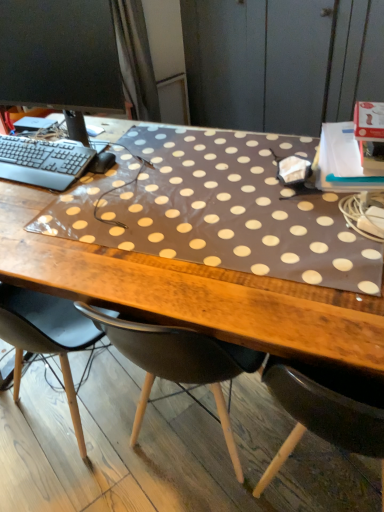
The image size is (384, 512). What are the coordinates of `black plastic keyboard at left` in the screenshot? It's located at (43, 162).

What is the approximate width of black glossy monitor at upper left?

black glossy monitor at upper left is 13.52 centimeters in width.

The image size is (384, 512). Identify the location of brown fabric dresser at upper right. (281, 61).

From the image's perspective, would you say black plastic keyboard at left is positioned over black glossy monitor at upper left?

No.

Is black plastic keyboard at left far from black glossy monitor at upper left?

No, black plastic keyboard at left is not far from black glossy monitor at upper left.

Who is shorter, black plastic keyboard at left or black glossy monitor at upper left?

With less height is black plastic keyboard at left.

Between black plastic keyboard at left and black glossy monitor at upper left, which one has smaller width?

black glossy monitor at upper left.

Is black glossy monitor at upper left facing towards black matte mouse at center?

Yes.

Is black glossy monitor at upper left surrounding black matte mouse at center?

Yes, black glossy monitor at upper left is surrounding black matte mouse at center.

Is black glossy monitor at upper left bigger than black matte mouse at center?

Yes, black glossy monitor at upper left is bigger than black matte mouse at center.

What's the angular difference between black glossy monitor at upper left and black matte mouse at center's facing directions?

black glossy monitor at upper left and black matte mouse at center are facing 0.798 degrees away from each other.

Is brown polka dot mat at center looking in the opposite direction of black glossy monitor at upper left?

No, black glossy monitor at upper left is not at the back of brown polka dot mat at center.

From a real-world perspective, is brown polka dot mat at center over black glossy monitor at upper left?

Actually, brown polka dot mat at center is physically below black glossy monitor at upper left in the real world.

From the image's perspective, is brown polka dot mat at center positioned above or below black glossy monitor at upper left?

Based on their image positions, brown polka dot mat at center is located beneath black glossy monitor at upper left.

This screenshot has width=384, height=512. In order to click on computer monitor above the brown polka dot mat at center (from the image's perspective) in this screenshot , I will do `click(60, 55)`.

Based on the photo, considering the relative sizes of brown fabric dresser at upper right and black glossy monitor at upper left in the image provided, is brown fabric dresser at upper right thinner than black glossy monitor at upper left?

No, brown fabric dresser at upper right is not thinner than black glossy monitor at upper left.

From the image's perspective, is brown fabric dresser at upper right positioned above or below black glossy monitor at upper left?

brown fabric dresser at upper right is above black glossy monitor at upper left.

Can you tell me how much brown fabric dresser at upper right and black glossy monitor at upper left differ in facing direction?

There is a 28.2-degree angle between the facing directions of brown fabric dresser at upper right and black glossy monitor at upper left.

Identify the location of dresser on the right of black glossy monitor at upper left. (281, 61).

Which object is closer to the camera, brown polka dot mat at center or black plastic keyboard at left?

brown polka dot mat at center is in front.

From the image's perspective, is brown polka dot mat at center above or below black plastic keyboard at left?

brown polka dot mat at center is situated lower than black plastic keyboard at left in the image.

Which is closer to the camera, (x=136, y=265) or (x=6, y=160)?

Clearly, point (x=136, y=265) is closer to the camera than point (x=6, y=160).

Is brown polka dot mat at center touching black plastic keyboard at left?

No, brown polka dot mat at center is not beside black plastic keyboard at left.

From the picture: Is brown fabric dresser at upper right looking in the opposite direction of black matte mouse at center?

brown fabric dresser at upper right is not turned away from black matte mouse at center.

How many degrees apart are the facing directions of brown fabric dresser at upper right and black matte mouse at center?

They differ by 29 degrees in their facing directions.

Does brown fabric dresser at upper right have a smaller size compared to black matte mouse at center?

Incorrect, brown fabric dresser at upper right is not smaller in size than black matte mouse at center.

From the picture: Measure the distance between brown fabric dresser at upper right and black matte mouse at center.

brown fabric dresser at upper right and black matte mouse at center are 1.44 meters apart from each other.

Does point (275, 7) appear closer or farther from the camera than point (91, 149)?

Point (275, 7) is positioned farther from the camera compared to point (91, 149).

Is brown fabric dresser at upper right with black plastic keyboard at left?

brown fabric dresser at upper right and black plastic keyboard at left are clearly separated.

From a real-world perspective, which object rests below the other?

In real-world perspective, brown fabric dresser at upper right is lower.

Find the location of a particular element. The width and height of the screenshot is (384, 512). dresser on the right of black plastic keyboard at left is located at coordinates click(281, 61).

Image resolution: width=384 pixels, height=512 pixels. I want to click on computer monitor on the right of the black plastic keyboard at left, so click(60, 55).

Locate an element on the screen. This screenshot has height=512, width=384. computer monitor above the black matte mouse at center (from a real-world perspective) is located at coordinates (60, 55).

Which object lies further to the anchor point black plastic keyboard at left, black matte mouse at center or black glossy monitor at upper left?

black glossy monitor at upper left is further to black plastic keyboard at left.

Estimate the real-world distances between objects in this image. Which object is closer to black glossy monitor at upper left, brown polka dot mat at center or black matte mouse at center?

black matte mouse at center.

When comparing their distances from brown polka dot mat at center, does black matte mouse at center or black glossy monitor at upper left seem further?

black matte mouse at center.

From the image, which object appears to be farther from brown polka dot mat at center, black plastic keyboard at left or black glossy monitor at upper left?

black glossy monitor at upper left lies further to brown polka dot mat at center than the other object.

Estimate the real-world distances between objects in this image. Which object is further from black plastic keyboard at left, brown fabric dresser at upper right or brown polka dot mat at center?

brown fabric dresser at upper right.

When comparing their distances from brown polka dot mat at center, does black plastic keyboard at left or brown fabric dresser at upper right seem further?

brown fabric dresser at upper right.

From the image, which object appears to be nearer to brown polka dot mat at center, brown fabric dresser at upper right or black plastic keyboard at left?

black plastic keyboard at left is positioned closer to the anchor brown polka dot mat at center.

Looking at the image, which one is located further to black glossy monitor at upper left, brown fabric dresser at upper right or black matte mouse at center?

brown fabric dresser at upper right.

Identify the location of computer keyboard between black glossy monitor at upper left and brown polka dot mat at center in the up-down direction. (43, 162).

Identify the location of mouse located between black glossy monitor at upper left and brown fabric dresser at upper right in the left-right direction. This screenshot has height=512, width=384. (102, 162).

Locate an element on the screen. mouse between black plastic keyboard at left and brown fabric dresser at upper right from left to right is located at coordinates (102, 162).

At what (x,y) coordinates should I click in order to perform the action: click on computer monitor situated between black plastic keyboard at left and brown fabric dresser at upper right from left to right. Please return your answer as a coordinate pair (x, y). The width and height of the screenshot is (384, 512). Looking at the image, I should click on (60, 55).